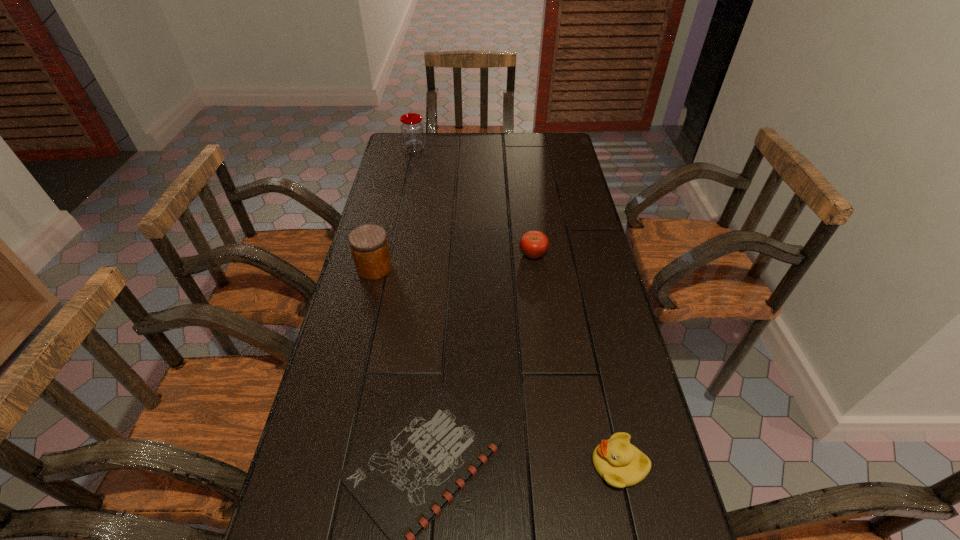
This screenshot has height=540, width=960. I want to click on free area in between the duckling and the nearer jar, so click(x=496, y=366).

At what (x,y) coordinates should I click in order to perform the action: click on free space between the nearer jar and the fourth object from left to right. Please return your answer as a coordinate pair (x, y). Looking at the image, I should click on (454, 261).

Choose which object is the third nearest neighbor to the shortest object. Please provide its 2D coordinates. Your answer should be formatted as a tuple, i.e. [(x, y)], where the tuple contains the x and y coordinates of a point satisfying the conditions above.

[(534, 244)]

Locate an element on the screen. This screenshot has width=960, height=540. object identified as the fourth closest to the notebook is located at coordinates pos(412,128).